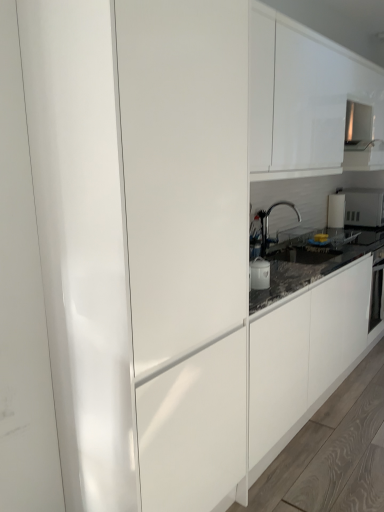
Image resolution: width=384 pixels, height=512 pixels. Identify the location of vacant space to the right of white glossy pot at center, the 2th appliance when ordered from back to front. (282, 280).